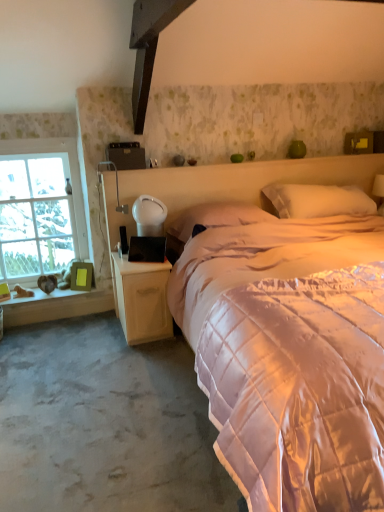
Identify the location of vacant space that is to the left of wooden nightstand at lower left. This screenshot has width=384, height=512. (89, 336).